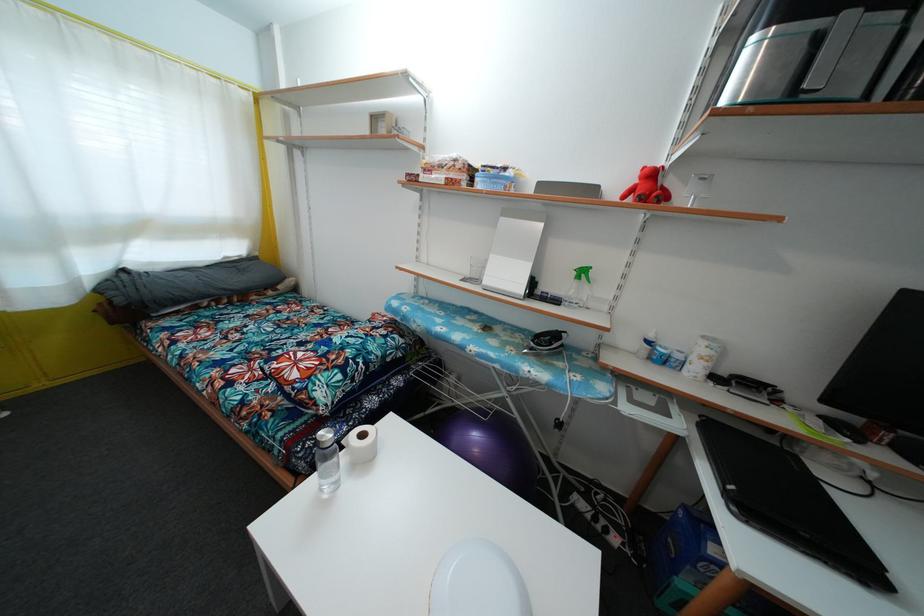
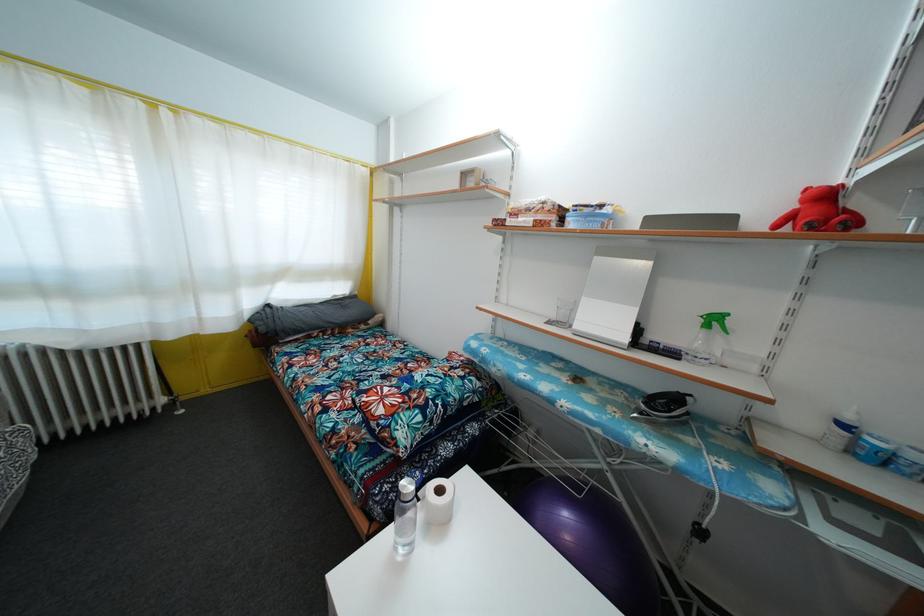
Locate, in the second image, the point that corresponds to pixel 508 176 in the first image.

(605, 213)